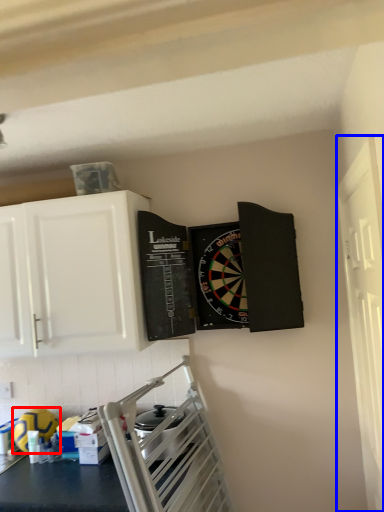
Question: Which object is further to the camera taking this photo, appliance (highlighted by a red box) or window (highlighted by a blue box)?

Choices:
 (A) appliance
 (B) window

Answer: (A)